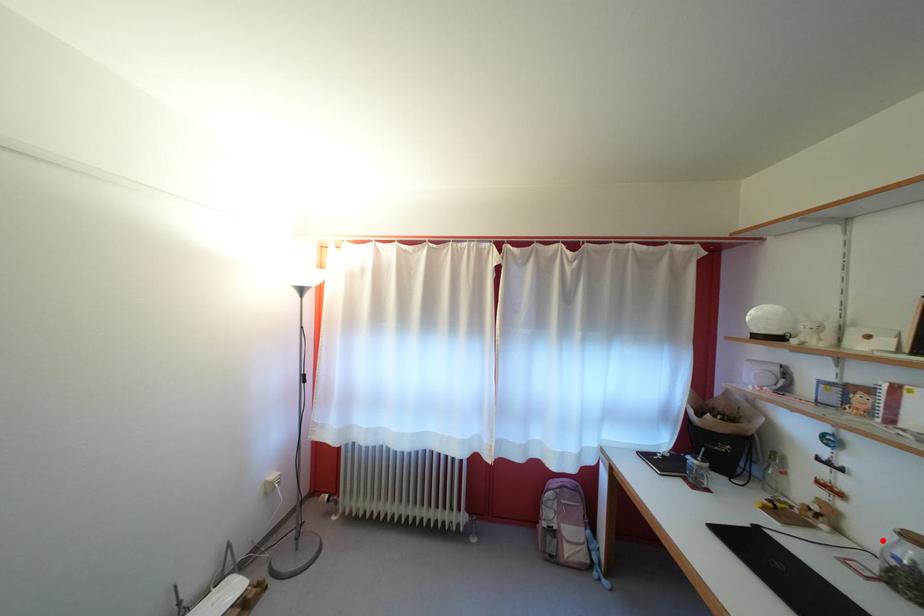
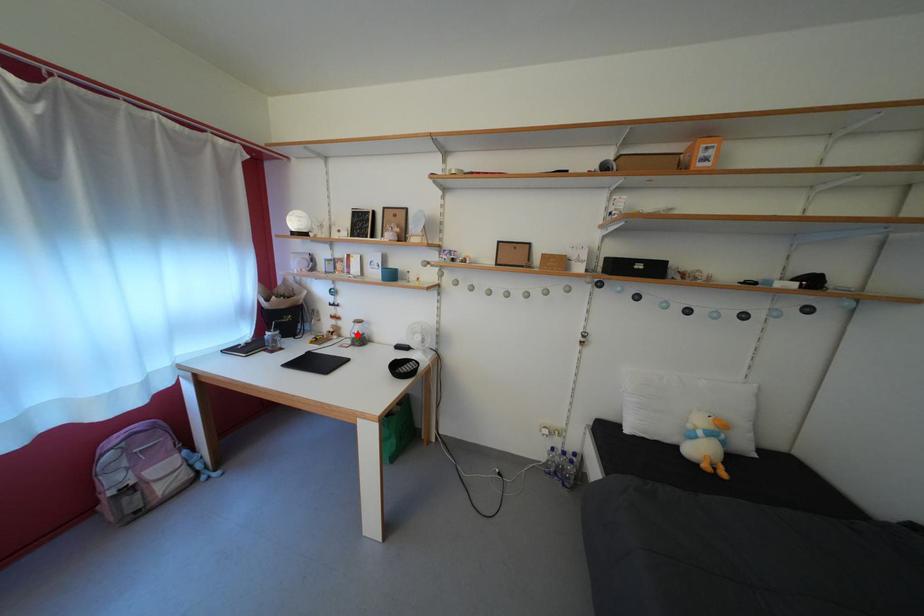
I am providing you with two images of the same scene from different viewpoints. A red point is marked on the first image and another point is marked on the second image. Does the point marked in image1 correspond to the same location as the one in image2?

Yes